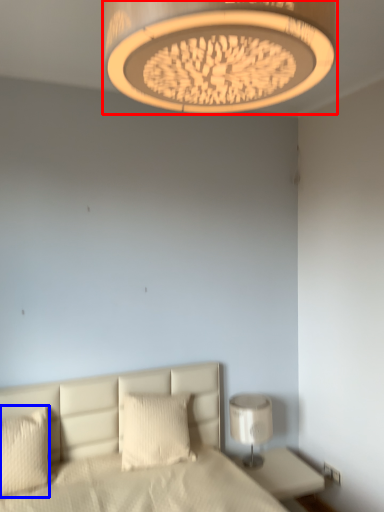
Question: Which object is closer to the camera taking this photo, lamp (highlighted by a red box) or pillow (highlighted by a blue box)?

Choices:
 (A) lamp
 (B) pillow

Answer: (A)